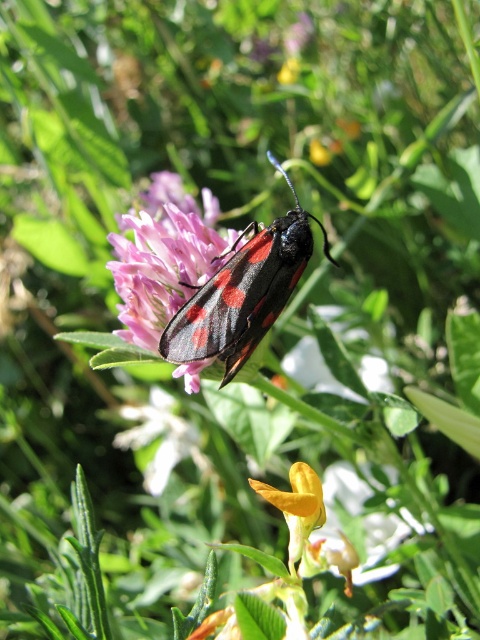
You are an entomologist observing a moth and a flower in a garden. You notice the matte black moth at center and the smooth yellow flower at center. Based on their positions, which one is located to the left?

The matte black moth at center is to the left of the smooth yellow flower at center.

You are an entomologist observing the scene. You notice the matte black moth at center and the smooth yellow flower at center. Which object is positioned closer to your viewpoint?

The matte black moth at center is closer to the viewer than the smooth yellow flower at center.